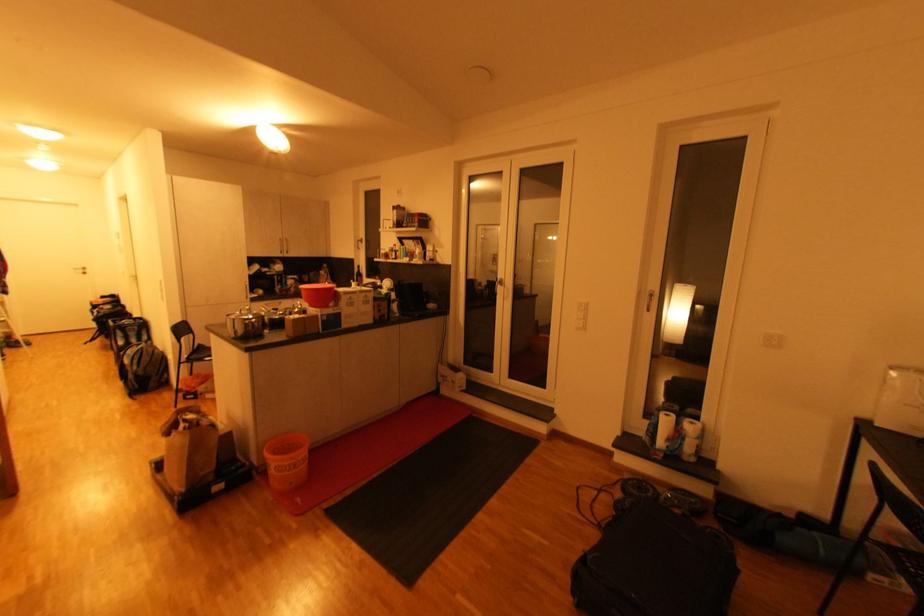
The height and width of the screenshot is (616, 924). What do you see at coordinates (318, 294) in the screenshot? I see `the red plastic bowl` at bounding box center [318, 294].